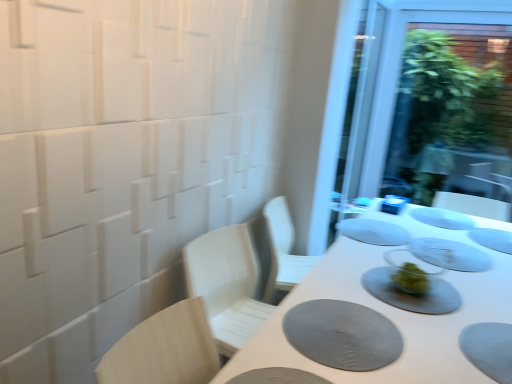
At what (x,y) coordinates should I click in order to perform the action: click on free space on the front side of clear glass plate at center, which is the 2th tableware from front to back. Please return your answer as a coordinate pair (x, y). Looking at the image, I should click on (471, 283).